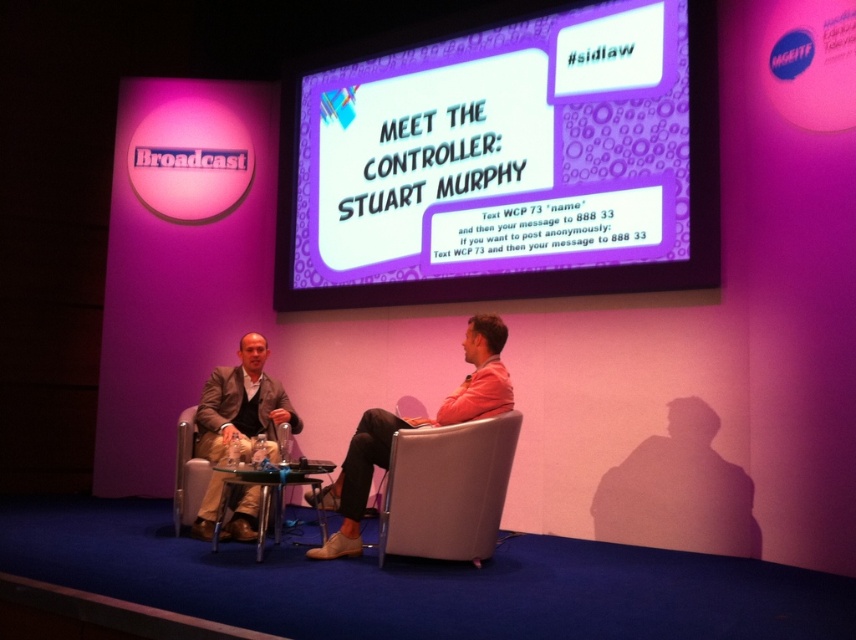
Is pink fabric chair at center in front of metallic silver chair at center?

Yes, it is.

Consider the image. Is the position of pink fabric chair at center more distant than that of metallic silver chair at center?

No.

Consider the image. Measure the distance between point (498, 376) and camera.

The distance of point (498, 376) from camera is 3.57 meters.

Find the location of `pink fabric chair at center`. pink fabric chair at center is located at coordinates (413, 428).

Does point (412, 556) lie behind point (183, 486)?

No, (412, 556) is in front of (183, 486).

Can you confirm if leather at right is positioned to the left of metallic silver chair at center?

Incorrect, leather at right is not on the left side of metallic silver chair at center.

Where is `leather at right`? This screenshot has height=640, width=856. leather at right is located at coordinates (447, 490).

Which is below, leather at right or pink fabric chair at center?

Positioned lower is leather at right.

Between leather at right and pink fabric chair at center, which one appears on the right side from the viewer's perspective?

From the viewer's perspective, leather at right appears more on the right side.

Where is `leather at right`? leather at right is located at coordinates (447, 490).